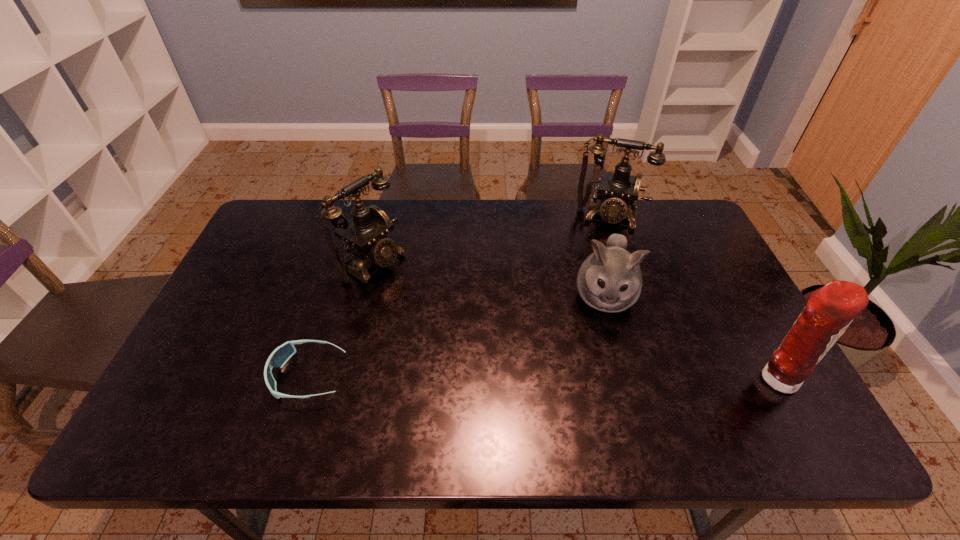
Find the location of a particular element. The width and height of the screenshot is (960, 540). free space located 0.280m on the rotary dial of the nearer telephone is located at coordinates (470, 321).

Locate an element on the screen. The image size is (960, 540). vacant space positioned on the rotary dial of the nearer telephone is located at coordinates (408, 284).

The height and width of the screenshot is (540, 960). I want to click on free space located 0.240m on the rotary dial of the farthest object, so click(x=593, y=282).

Where is `vacant space situated on the rotary dial of the farthest object`? This screenshot has width=960, height=540. vacant space situated on the rotary dial of the farthest object is located at coordinates (595, 273).

Identify the location of free space located 0.310m on the rotary dial of the farthest object. (590, 299).

Locate an element on the screen. free location located 0.150m on the face of the second shortest object is located at coordinates (600, 376).

I want to click on free spot located 0.050m on the face of the second shortest object, so click(603, 343).

This screenshot has width=960, height=540. I want to click on free space located on the face of the second shortest object, so click(602, 356).

What are the coordinates of `goggles positioned at the near edge` in the screenshot? It's located at (278, 358).

In order to click on condiment present at the near edge in this screenshot , I will do `click(829, 311)`.